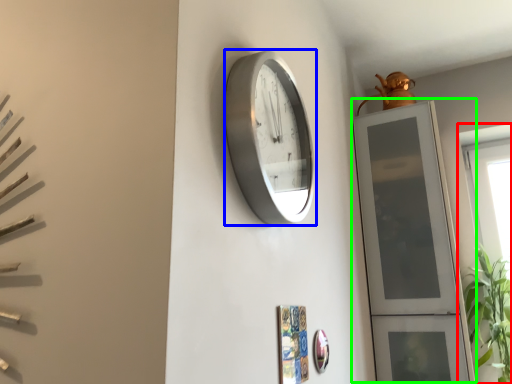
Question: Which object is positioned closest to window (highlighted by a red box)? Select from wall clock (highlighted by a blue box) and glass door (highlighted by a green box).

Choices:
 (A) wall clock
 (B) glass door

Answer: (B)